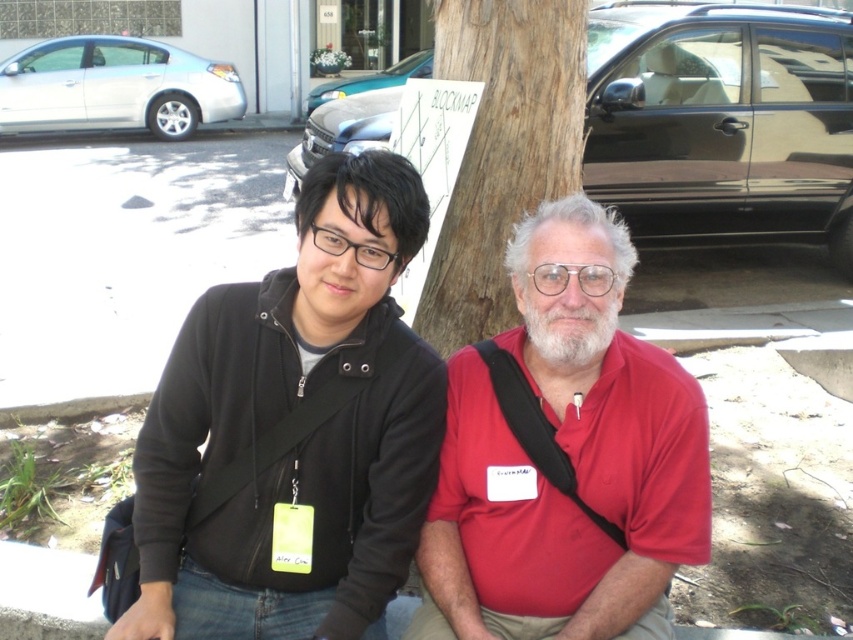
Question: Considering the relative positions of matte black jacket at center and red matte shirt at center in the image provided, where is matte black jacket at center located with respect to red matte shirt at center?

Choices:
 (A) left
 (B) right

Answer: (A)

Question: In this image, where is red matte shirt at center located relative to brown textured tree trunk at center?

Choices:
 (A) below
 (B) above

Answer: (A)

Question: Which point is farther from the camera taking this photo?

Choices:
 (A) (630, 433)
 (B) (567, 36)

Answer: (B)

Question: Does matte black jacket at center come behind brown textured tree trunk at center?

Choices:
 (A) no
 (B) yes

Answer: (A)

Question: Which is farther from the matte black jacket at center?

Choices:
 (A) red matte shirt at center
 (B) brown textured tree trunk at center

Answer: (B)

Question: Among these objects, which one is nearest to the camera?

Choices:
 (A) brown textured tree trunk at center
 (B) red matte shirt at center

Answer: (B)